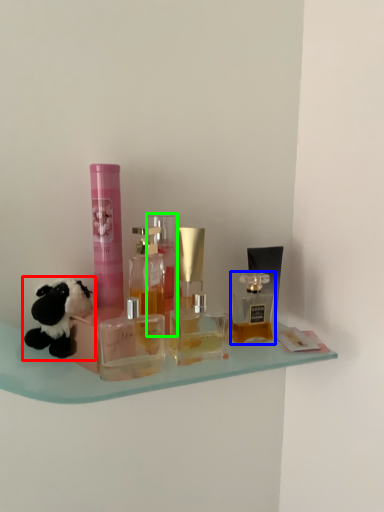
Question: Estimate the real-world distances between objects in this image. Which object is farther from toy (highlighted by a red box), bottle (highlighted by a blue box) or bottle (highlighted by a green box)?

Choices:
 (A) bottle
 (B) bottle

Answer: (A)